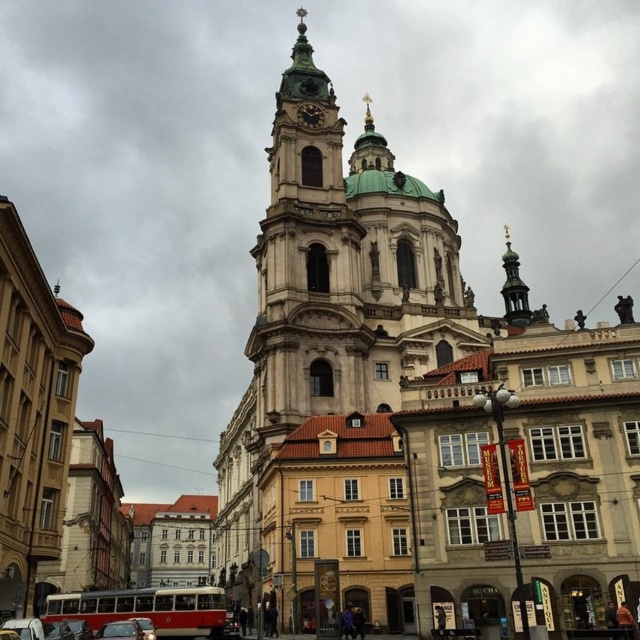
Is red painted metal bus at lower left smaller than metallic silver car at lower left?

Incorrect, red painted metal bus at lower left is not smaller in size than metallic silver car at lower left.

Between red painted metal bus at lower left and metallic silver car at lower left, which one appears on the left side from the viewer's perspective?

From the viewer's perspective, red painted metal bus at lower left appears more on the left side.

Is point (65, 593) positioned after point (106, 632)?

Yes, it is behind point (106, 632).

I want to click on red painted metal bus at lower left, so click(147, 609).